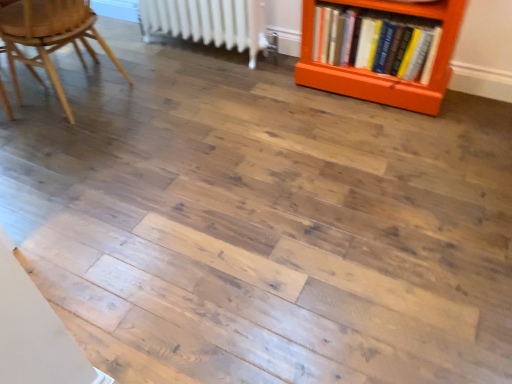
Question: In terms of width, does white metallic radiator at upper center look wider or thinner when compared to hardcover books at right?

Choices:
 (A) wide
 (B) thin

Answer: (B)

Question: Looking at the image, does white metallic radiator at upper center seem bigger or smaller compared to hardcover books at right?

Choices:
 (A) small
 (B) big

Answer: (B)

Question: Which object is positioned farthest from the wooden chair at left?

Choices:
 (A) hardcover books at right
 (B) white metallic radiator at upper center

Answer: (A)

Question: Which object is the closest to the wooden chair at left?

Choices:
 (A) white metallic radiator at upper center
 (B) hardcover books at right

Answer: (A)